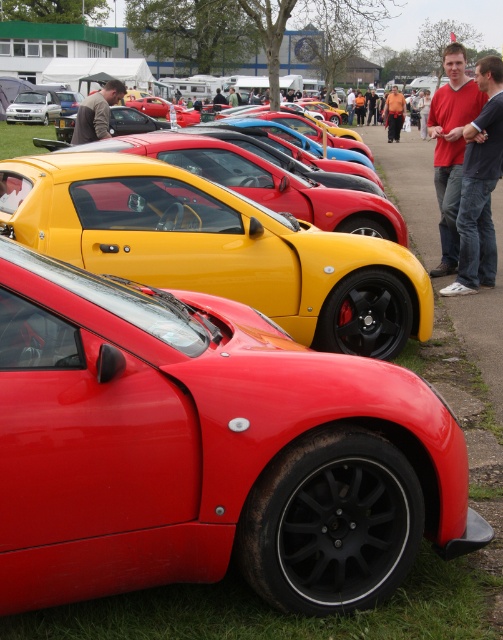
Question: Which object appears farthest from the camera in this image?

Choices:
 (A) matte gray shirt at upper left
 (B) matte silver car at left

Answer: (B)

Question: Does glossy red sports car at lower left have a greater width compared to matte black sports car at center?

Choices:
 (A) yes
 (B) no

Answer: (B)

Question: In this image, where is matte red shirt at right located relative to matte gray shirt at upper left?

Choices:
 (A) above
 (B) below

Answer: (B)

Question: Does matte black sports car at center appear over matte silver car at left?

Choices:
 (A) yes
 (B) no

Answer: (B)

Question: Among these points, which one is farthest from the camera?

Choices:
 (A) (415, 268)
 (B) (497, 115)

Answer: (B)

Question: Which point is closer to the camera?

Choices:
 (A) (3, 179)
 (B) (194, 458)

Answer: (B)